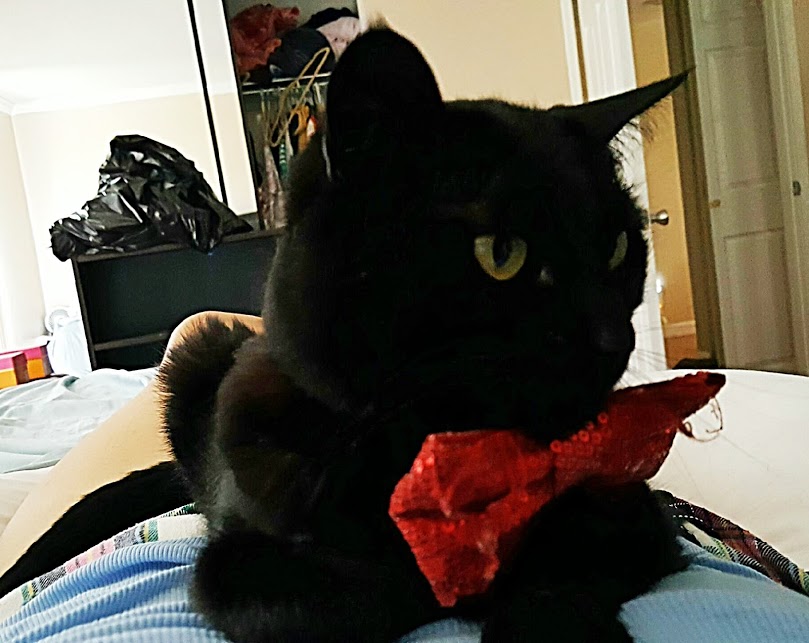
At what (x,y) coordinates should I click in order to perform the action: click on trash bag. Please return your answer as a coordinate pair (x, y). The height and width of the screenshot is (643, 809). Looking at the image, I should click on (147, 201).